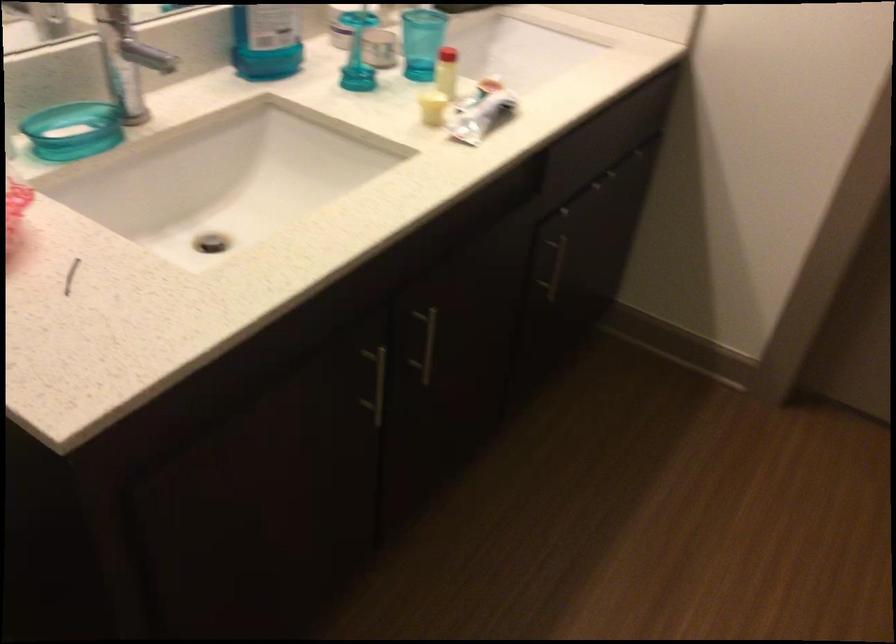
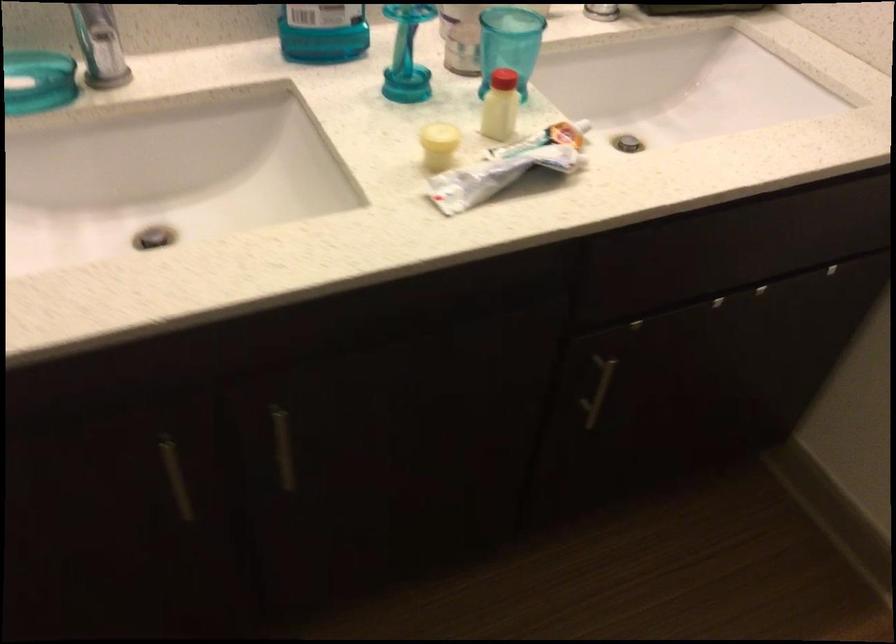
In the second image, find the point that corresponds to [366,393] in the first image.

(176, 477)